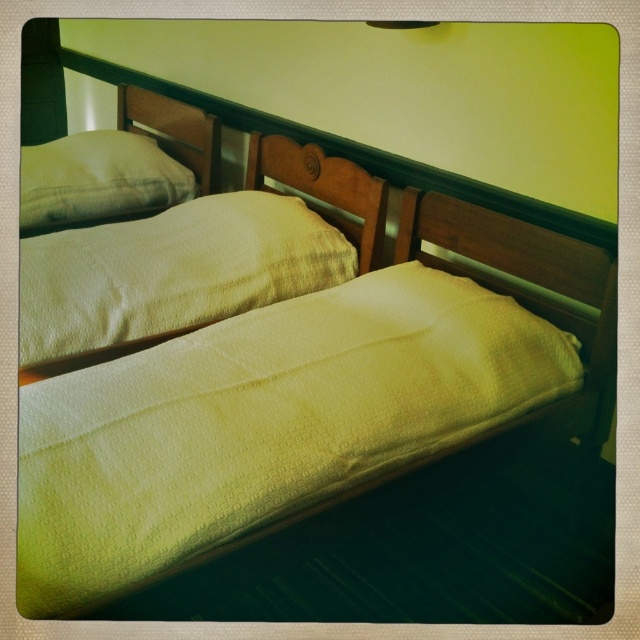
From the picture: Is white textured pillow at upper left wider than wooden headboard at center?

Indeed, white textured pillow at upper left has a greater width compared to wooden headboard at center.

Can you confirm if white textured pillow at upper left is smaller than wooden headboard at center?

Incorrect, white textured pillow at upper left is not smaller in size than wooden headboard at center.

Is point (22, 150) farther from viewer compared to point (342, 234)?

That is True.

The image size is (640, 640). Identify the location of white textured pillow at upper left. (97, 180).

Who is lower down, white textured pillow at upper center or white textured pillow at upper left?

Positioned lower is white textured pillow at upper center.

Between point (285, 257) and point (106, 164), which one is positioned behind?

The point (106, 164) is more distant.

Which is in front, point (308, 211) or point (108, 164)?

Point (308, 211)

Identify the location of white textured pillow at upper center. This screenshot has height=640, width=640. (172, 272).

Who is positioned more to the right, white textured pillow at upper center or wooden headboard at center?

Positioned to the right is wooden headboard at center.

Is white textured pillow at upper center wider than wooden headboard at center?

Indeed, white textured pillow at upper center has a greater width compared to wooden headboard at center.

Who is more distant from viewer, (170, 278) or (298, 170)?

The point (298, 170) is behind.

Where is `white textured pillow at upper center`? This screenshot has height=640, width=640. white textured pillow at upper center is located at coordinates (172, 272).